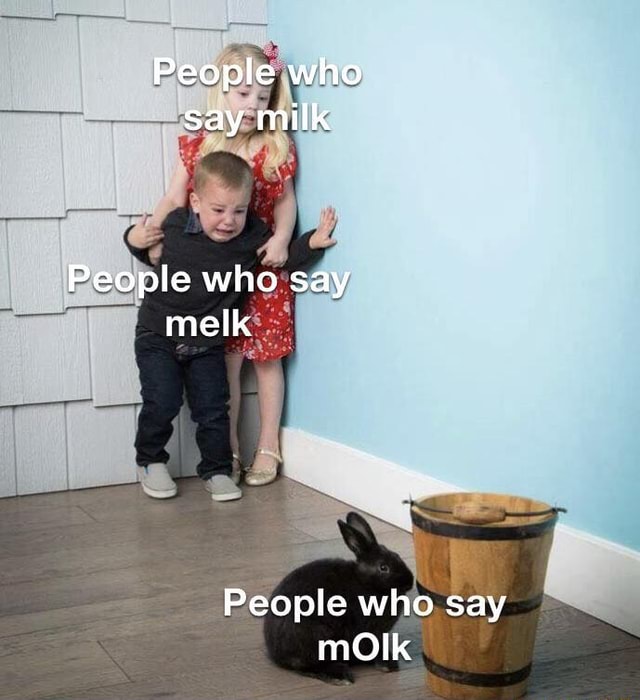
You are a GUI agent. You are given a task and a screenshot of the screen. Output one action in this format:
    pyautogui.click(x=<x>, y=<y>)
    Task: Click on the white baseboard
    
    Given the screenshot: What is the action you would take?
    pyautogui.click(x=379, y=496)